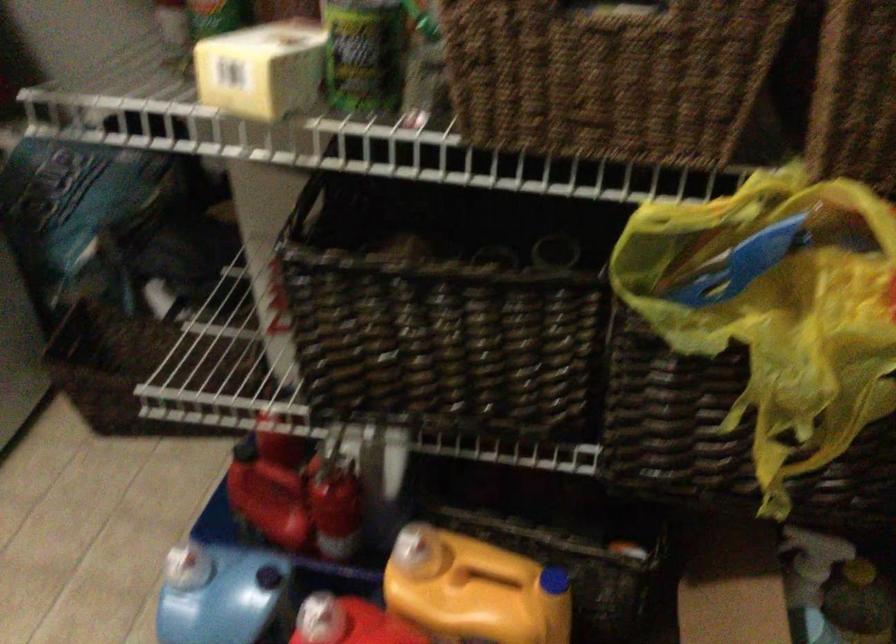
Find where to squeez the yellow spray nozzle. Please return your answer as a coordinate pair (x, y).

(474, 590)